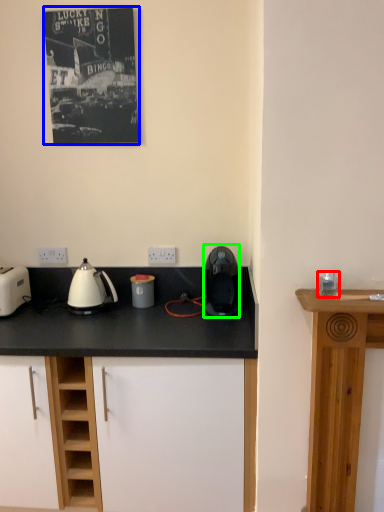
Question: Which object is positioned farthest from appliance (highlighted by a red box)? Select from picture frame (highlighted by a blue box) and kitchen appliance (highlighted by a green box).

Choices:
 (A) picture frame
 (B) kitchen appliance

Answer: (A)